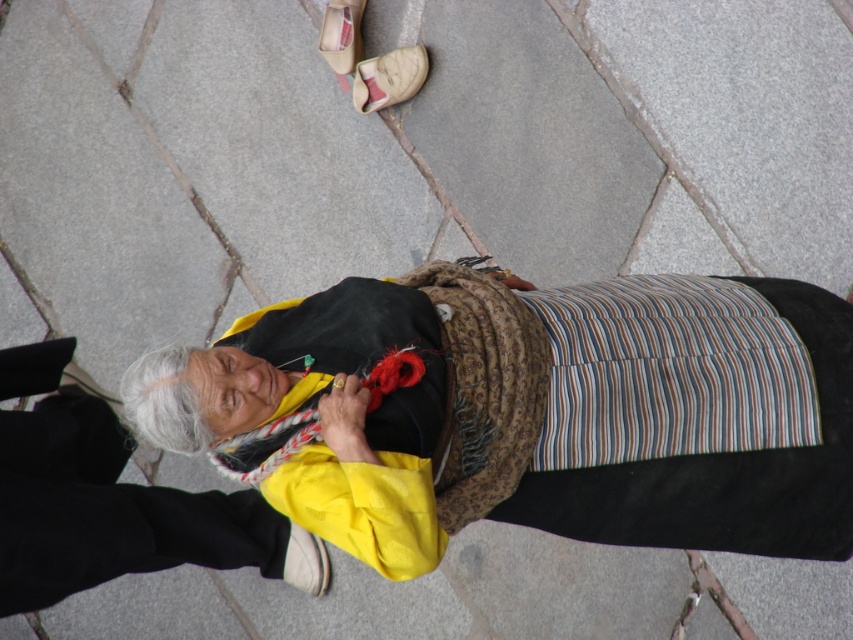
Does beige fabric sandal at upper center have a lesser height compared to white leather sandal at upper center?

Yes.

At what (x,y) coordinates should I click in order to perform the action: click on beige fabric sandal at upper center. Please return your answer as a coordinate pair (x, y). The height and width of the screenshot is (640, 853). Looking at the image, I should click on (389, 77).

Measure the distance between point (601, 358) and camera.

Point (601, 358) and camera are 3.91 meters apart.

Is yellow fabric scarf at center thinner than white leather sandal at upper center?

In fact, yellow fabric scarf at center might be wider than white leather sandal at upper center.

The image size is (853, 640). I want to click on yellow fabric scarf at center, so click(x=494, y=422).

In order to click on yellow fabric scarf at center in this screenshot , I will do `click(494, 422)`.

Can you confirm if yellow fabric scarf at center is positioned to the right of beige fabric sandal at upper center?

Yes, yellow fabric scarf at center is to the right of beige fabric sandal at upper center.

Where is `yellow fabric scarf at center`? yellow fabric scarf at center is located at coordinates (494, 422).

Who is more forward, (376, 285) or (410, 97)?

Positioned in front is point (376, 285).

The width and height of the screenshot is (853, 640). I want to click on yellow fabric scarf at center, so click(x=494, y=422).